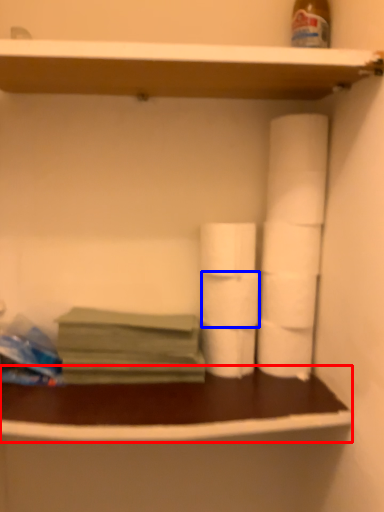
Question: Which point is further to the camera, counter (highlighted by a red box) or toilet paper (highlighted by a blue box)?

Choices:
 (A) counter
 (B) toilet paper

Answer: (B)